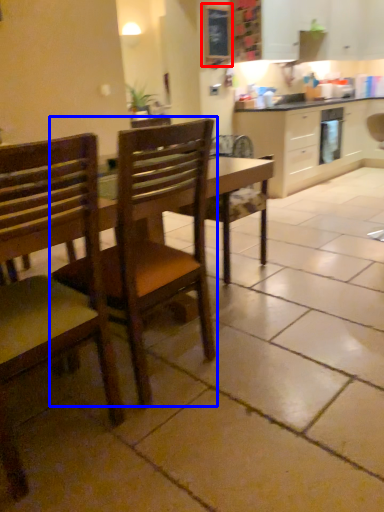
Question: Which object appears farthest to the camera in this image, bulletin board (highlighted by a red box) or chair (highlighted by a blue box)?

Choices:
 (A) bulletin board
 (B) chair

Answer: (A)